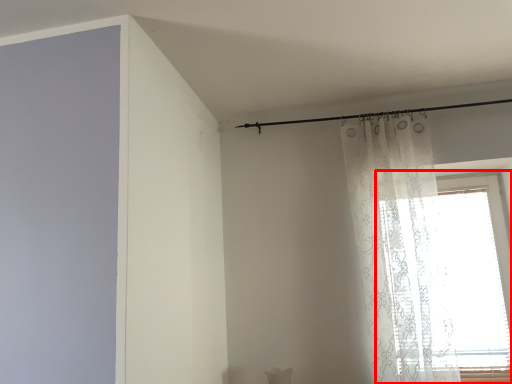
Question: Where is window (annotated by the red box) located in relation to curtain in the image?

Choices:
 (A) right
 (B) left

Answer: (A)